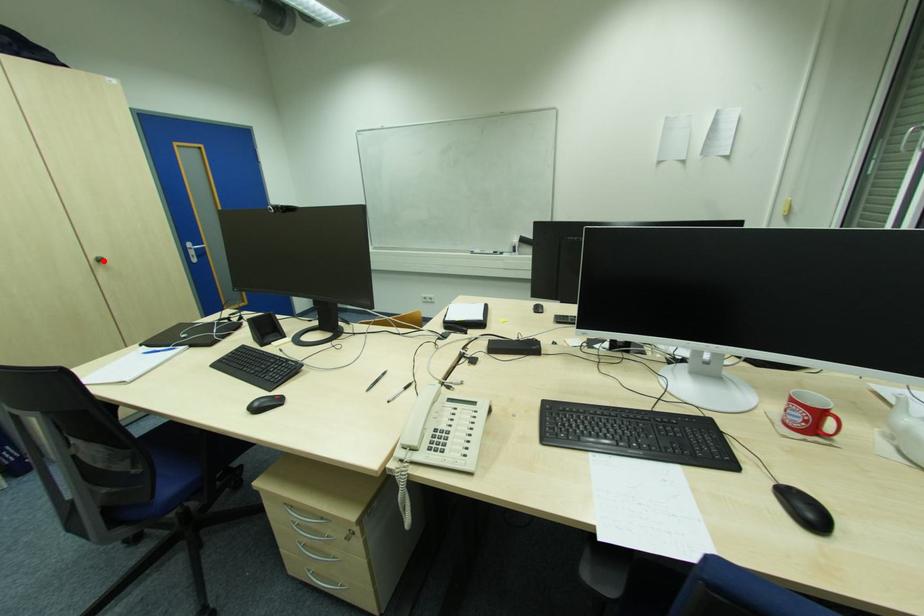
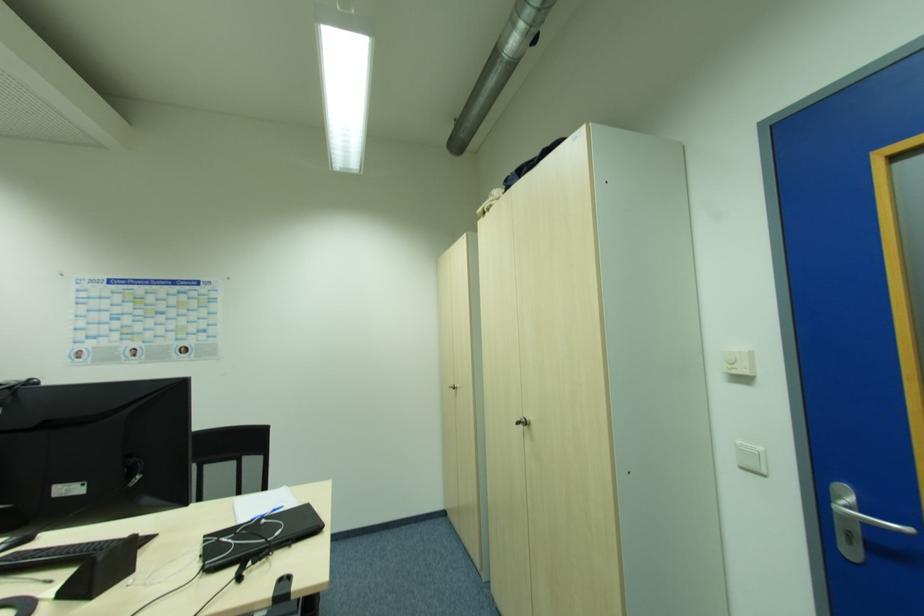
In the second image, find the point that corresponds to the highlighted location in the first image.

(526, 424)